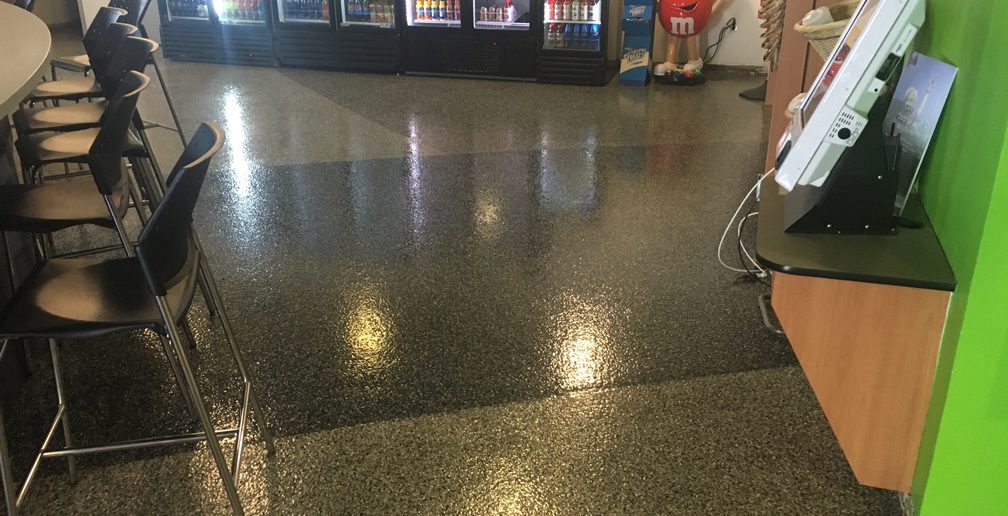
Image resolution: width=1008 pixels, height=516 pixels. I want to click on glass doors, so click(x=572, y=9), click(x=490, y=11), click(x=433, y=8), click(x=355, y=16), click(x=294, y=7), click(x=178, y=6).